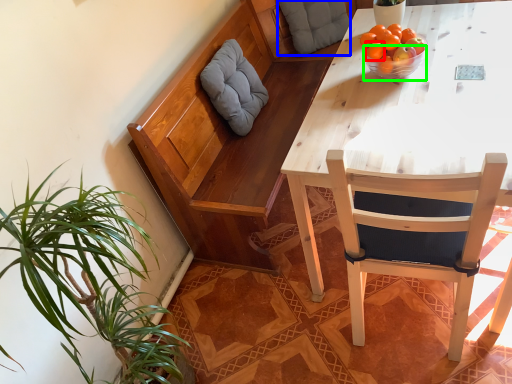
Question: Considering the real-world distances, which object is closest to orange (highlighted by a red box)? pillow (highlighted by a blue box) or bowl (highlighted by a green box).

Choices:
 (A) pillow
 (B) bowl

Answer: (B)